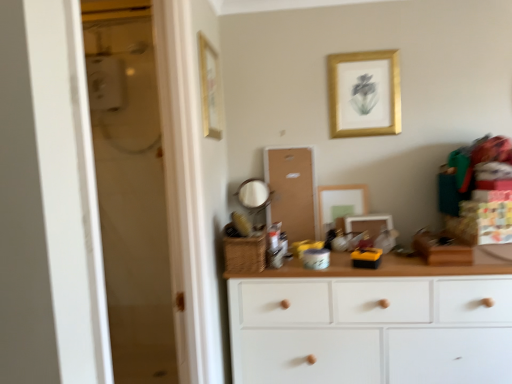
Question: From the image's perspective, is corkboard at center on top of matte white picture frame at center, positioned as the first picture frame in right-to-left order?

Choices:
 (A) no
 (B) yes

Answer: (B)

Question: Does corkboard at center contain matte white picture frame at center, positioned as the first picture frame in right-to-left order?

Choices:
 (A) no
 (B) yes

Answer: (A)

Question: Does corkboard at center lie behind matte white picture frame at center, positioned as the fourth picture frame in left-to-right order?

Choices:
 (A) no
 (B) yes

Answer: (B)

Question: Is corkboard at center at the left side of matte white picture frame at center, positioned as the first picture frame in right-to-left order?

Choices:
 (A) yes
 (B) no

Answer: (A)

Question: Are corkboard at center and matte white picture frame at center, positioned as the first picture frame in right-to-left order, far apart?

Choices:
 (A) yes
 (B) no

Answer: (B)

Question: Does point (208, 104) appear closer or farther from the camera than point (308, 278)?

Choices:
 (A) closer
 (B) farther

Answer: (B)

Question: From a real-world perspective, is wooden picture frame at upper center, which appears as the fourth picture frame when viewed from the right, physically located above or below white wood chest of drawers at center?

Choices:
 (A) above
 (B) below

Answer: (A)

Question: Considering the positions of wooden picture frame at upper center, which appears as the fourth picture frame when viewed from the right, and white wood chest of drawers at center in the image, is wooden picture frame at upper center, which appears as the fourth picture frame when viewed from the right, taller or shorter than white wood chest of drawers at center?

Choices:
 (A) short
 (B) tall

Answer: (A)

Question: In the image, is wooden picture frame at upper center, marked as the 1th picture frame in a left-to-right arrangement, on the left side or the right side of white wood chest of drawers at center?

Choices:
 (A) left
 (B) right

Answer: (A)

Question: Do you think gold/golden frame at upper center, which is the second picture frame in right-to-left order, is within matte gold picture frame at center, the 2th picture frame when ordered from left to right, or outside of it?

Choices:
 (A) inside
 (B) outside

Answer: (B)

Question: Considering the positions of gold/golden frame at upper center, which is the second picture frame in right-to-left order, and matte gold picture frame at center, the 2th picture frame when ordered from left to right, in the image, is gold/golden frame at upper center, which is the second picture frame in right-to-left order, taller or shorter than matte gold picture frame at center, the 2th picture frame when ordered from left to right,?

Choices:
 (A) short
 (B) tall

Answer: (B)

Question: From the image's perspective, relative to matte gold picture frame at center, which appears as the 3th picture frame when viewed from the right, is gold/golden frame at upper center, arranged as the third picture frame when viewed from the left, above or below?

Choices:
 (A) below
 (B) above

Answer: (B)

Question: In the image, is gold/golden frame at upper center, arranged as the third picture frame when viewed from the left, positioned in front of or behind matte gold picture frame at center, which appears as the 3th picture frame when viewed from the right?

Choices:
 (A) behind
 (B) front

Answer: (B)

Question: From the image's perspective, is matte white picture frame at center, positioned as the fourth picture frame in left-to-right order, positioned above or below matte gold picture frame at center, the 2th picture frame when ordered from left to right?

Choices:
 (A) below
 (B) above

Answer: (A)

Question: In terms of size, does matte white picture frame at center, positioned as the fourth picture frame in left-to-right order, appear bigger or smaller than matte gold picture frame at center, the 2th picture frame when ordered from left to right?

Choices:
 (A) small
 (B) big

Answer: (A)